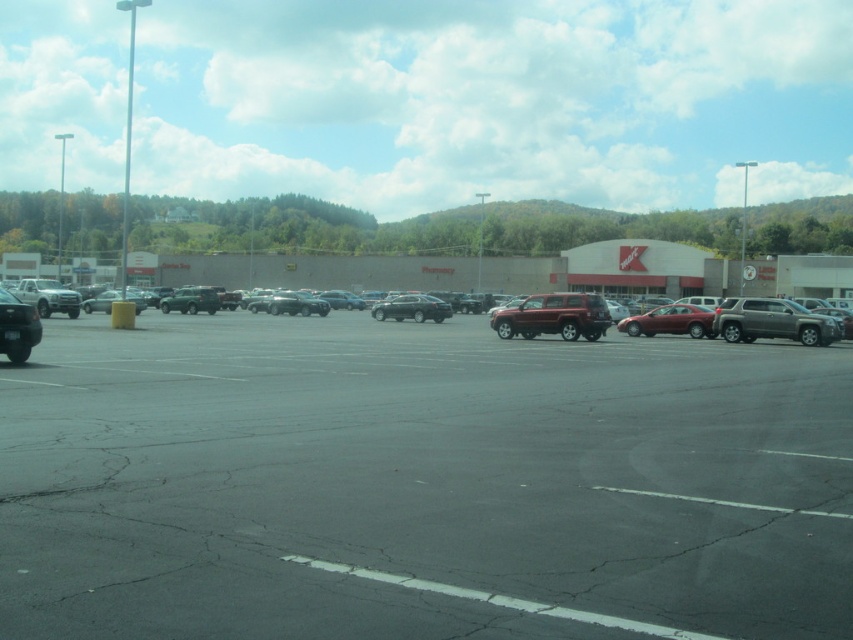
How much distance is there between satin silver suv at right and shiny black sedan at left?

A distance of 26.49 meters exists between satin silver suv at right and shiny black sedan at left.

Can you confirm if satin silver suv at right is positioned below shiny black sedan at left?

Incorrect, satin silver suv at right is not positioned below shiny black sedan at left.

Is point (801, 330) farther from viewer compared to point (3, 344)?

Yes, it is behind point (3, 344).

Find the location of a particular element. This screenshot has height=640, width=853. satin silver suv at right is located at coordinates pyautogui.click(x=773, y=321).

Is point (212, 545) more distant than point (492, 320)?

No, it is not.

Does asphalt at center appear on the left side of satin red suv at center?

Correct, you'll find asphalt at center to the left of satin red suv at center.

Image resolution: width=853 pixels, height=640 pixels. Describe the element at coordinates (419, 483) in the screenshot. I see `asphalt at center` at that location.

Locate an element on the screen. asphalt at center is located at coordinates (419, 483).

Is point (527, 310) less distant than point (683, 307)?

Yes, point (527, 310) is closer to viewer.

Is satin red suv at center smaller than satin red sedan at center?

Correct, satin red suv at center occupies less space than satin red sedan at center.

What do you see at coordinates (554, 316) in the screenshot? This screenshot has width=853, height=640. I see `satin red suv at center` at bounding box center [554, 316].

This screenshot has width=853, height=640. What are the coordinates of `satin red suv at center` in the screenshot? It's located at (554, 316).